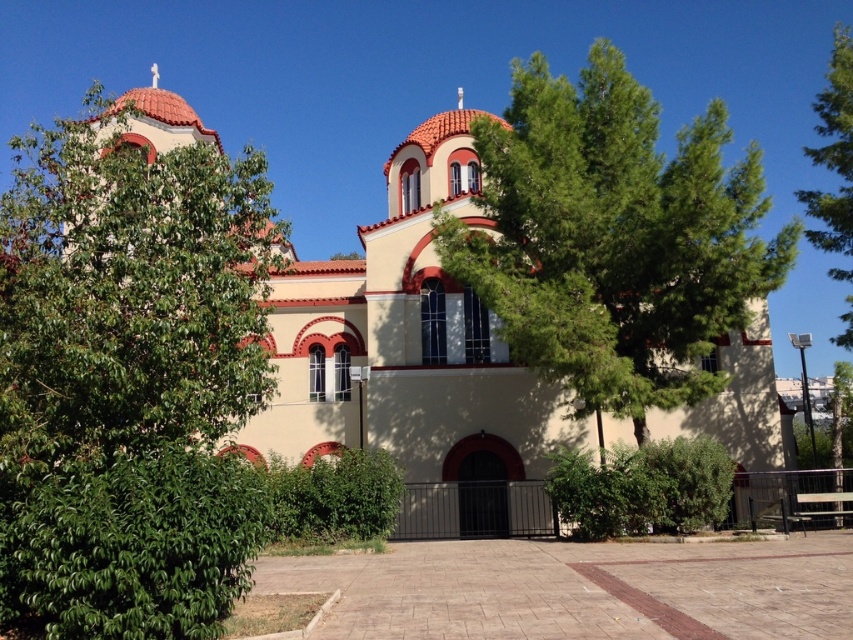
You are standing in front of the church and want to plant a new tree that needs more sunlight. Which tree, the green leafy tree at left or the green leafy tree at center, would cast less shadow over the new tree?

The green leafy tree at center would cast less shadow over the new tree because it is shorter than the green leafy tree at left.

You are standing in front of the church and want to take a photo that includes both the green leafy tree at left and the church itself. Given that your camera has a maximum zoom range of 10 meters, will you need to zoom in or out to ensure both are in frame?

The green leafy tree at left is 27.91 meters away from the camera, which is beyond the camera maximum zoom range of 10 meters. Therefore, you will need to zoom out to include both the tree and the church in the frame.